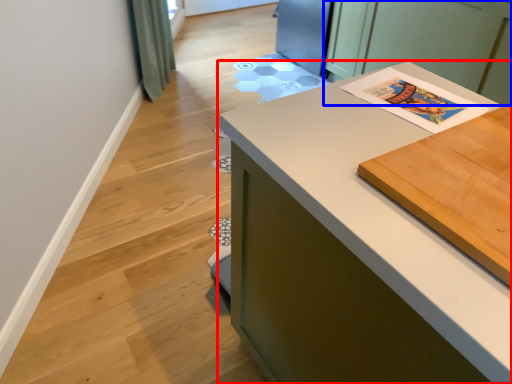
Question: Which object is further to the camera taking this photo, countertop (highlighted by a red box) or cabinetry (highlighted by a blue box)?

Choices:
 (A) countertop
 (B) cabinetry

Answer: (B)